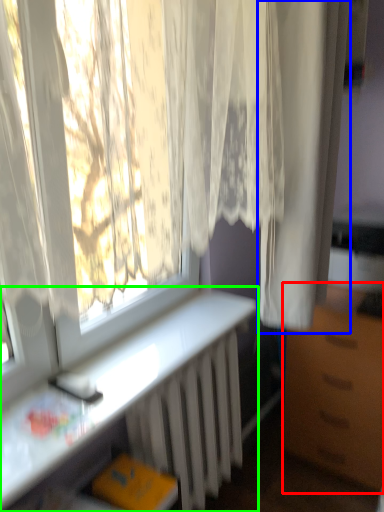
Question: Which is farther away from furniture (highlighted by a red box)? curtain (highlighted by a blue box) or desk (highlighted by a green box)?

Choices:
 (A) curtain
 (B) desk

Answer: (A)